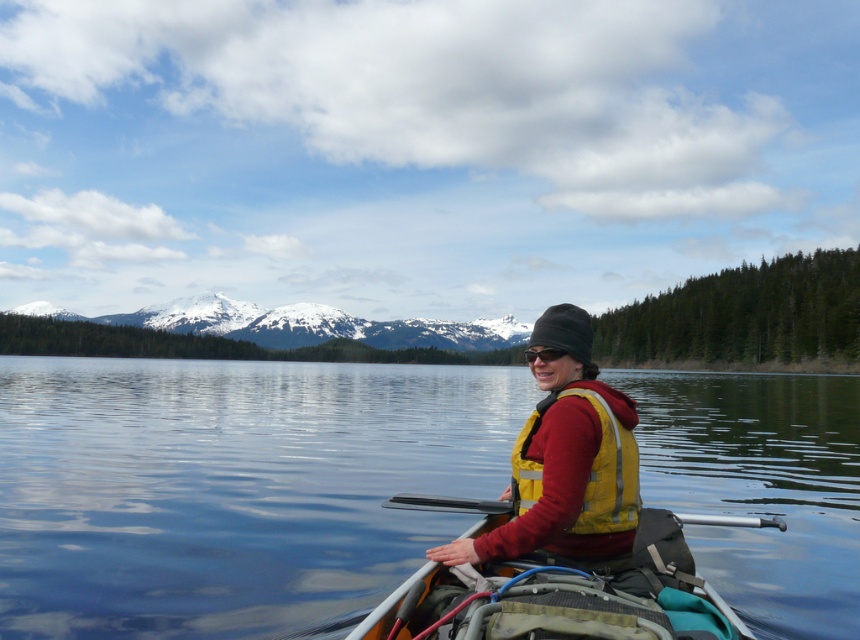
You are planning to store the yellow reflective life vest at center in the yellow fabric canoe at center. Based on their sizes, will the life vest fit inside the canoe?

The yellow fabric canoe at center is wider than the yellow reflective life vest at center, so the life vest will fit inside the canoe.

You are a photographer trying to capture the kayaker in the image. Since both the transparent water at center and the yellow reflective life jacket at center are in the scene, which one should be focused on to ensure the kayaker is clearly visible?

The yellow reflective life jacket at center should be focused on because the transparent water at center is located below it, making the life jacket the visible part of the kayaker.

You are a photographer trying to capture the reflection of the snowcapped mountains in the transparent water at center. Based on the scene description, can you confirm if the water surface is suitable for capturing clear reflections?

Yes, the transparent water at center is suitable for capturing clear reflections because it is described as transparent and the scene mentions the water is calm, which allows for reflective surfaces.